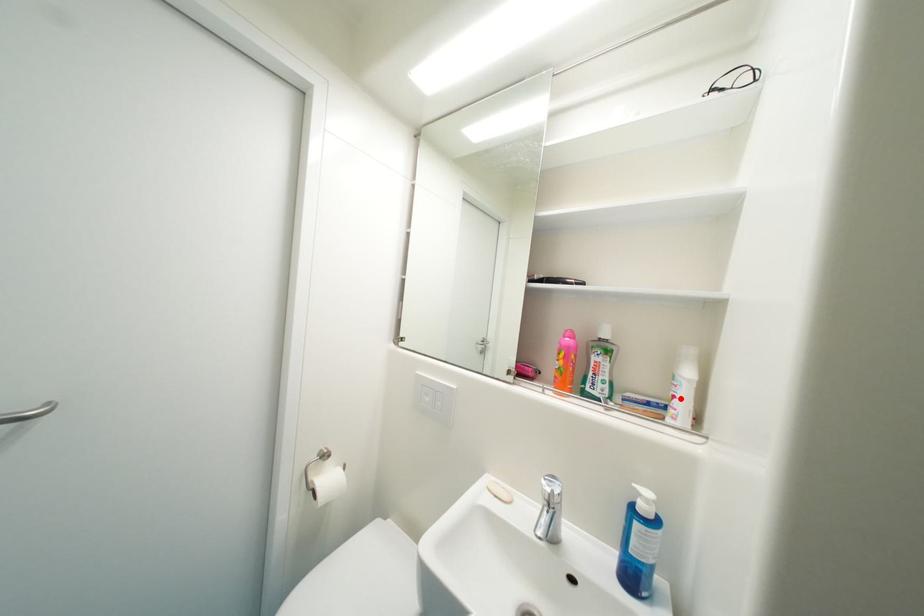
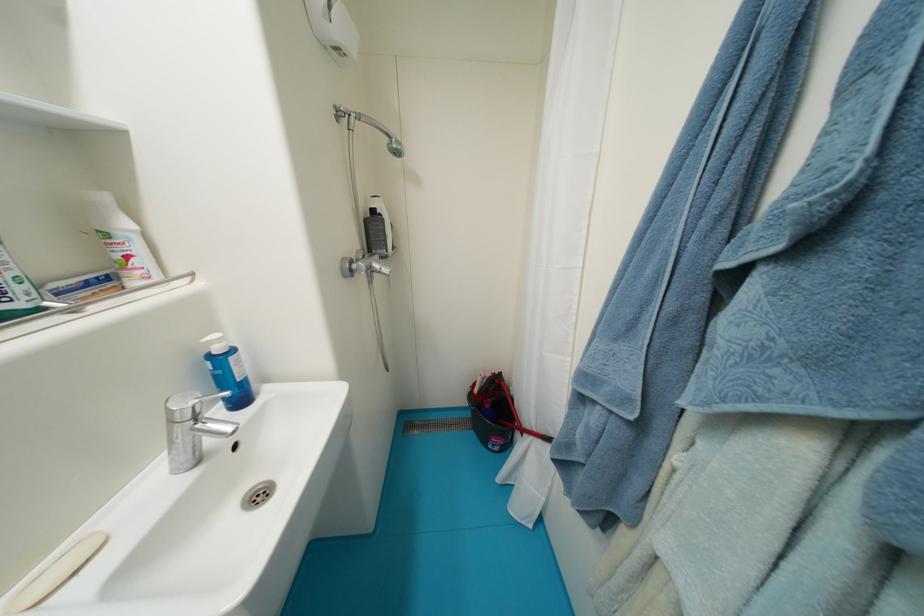
The point at the highlighted location is marked in the first image. Where is the corresponding point in the second image?

(134, 259)